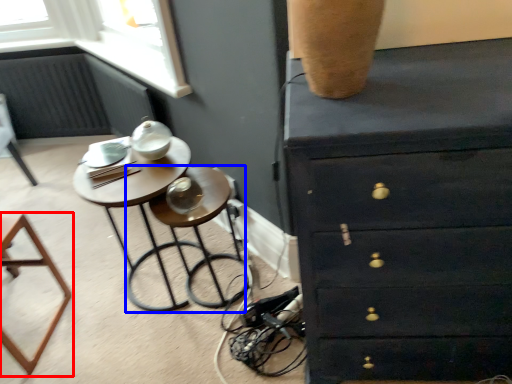
Question: Which of the following is the farthest to the observer, furniture (highlighted by a red box) or bar stool (highlighted by a blue box)?

Choices:
 (A) furniture
 (B) bar stool

Answer: (B)